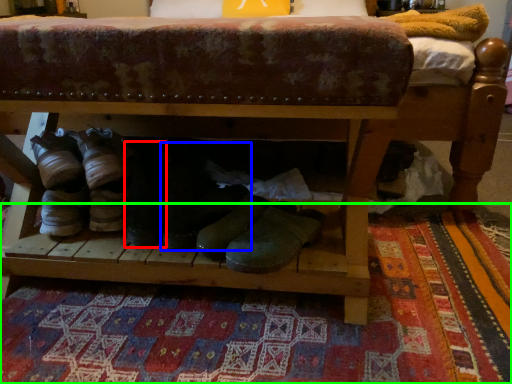
Question: Estimate the real-world distances between objects in this image. Which object is farther from footwear (highlighted by a red box), footwear (highlighted by a blue box) or mat (highlighted by a green box)?

Choices:
 (A) footwear
 (B) mat

Answer: (B)